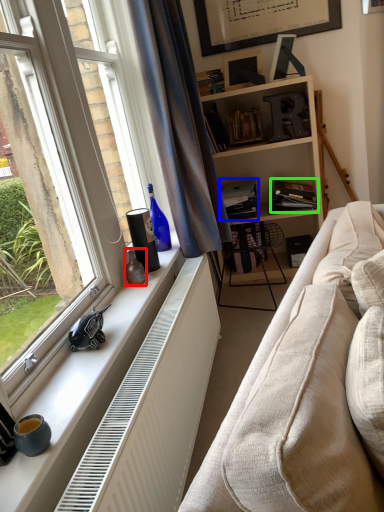
Question: Based on their relative distances, which object is farther from vase (highlighted by a red box)? Choose from book (highlighted by a blue box) and book (highlighted by a green box).

Choices:
 (A) book
 (B) book

Answer: (B)